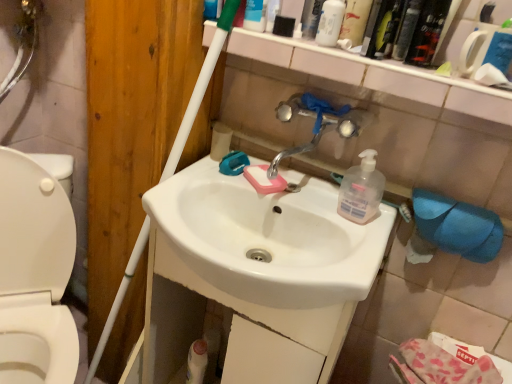
I want to click on free space in front of white matte toilet paper at upper center, acting as the second toilet paper starting from the right, so click(207, 175).